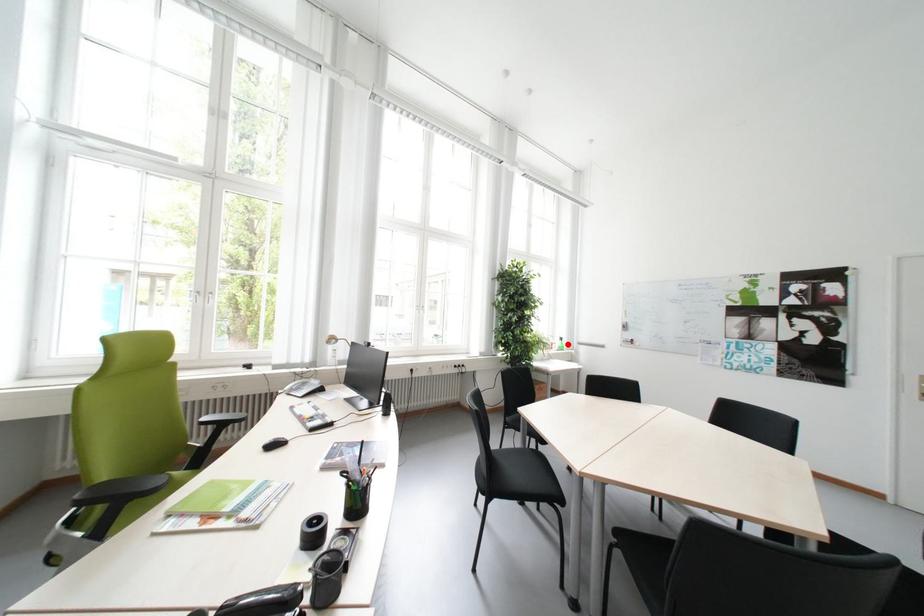
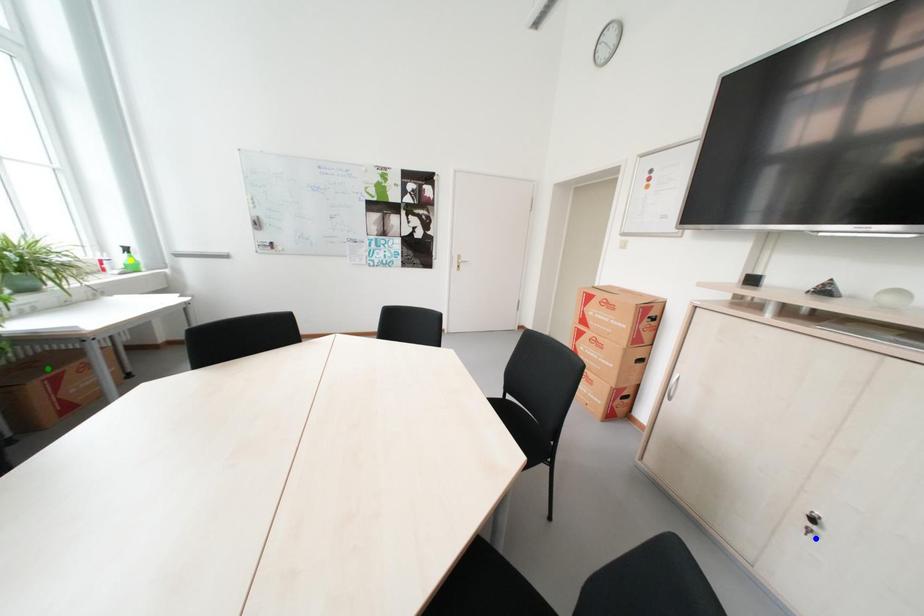
Question: I am providing you with two images of the same scene from different viewpoints. A red point is marked on the first image. You are given multiple points on the second image. Which point in image 2 represents the same 3d spot as the red point in image 1?

Choices:
 (A) green point
 (B) blue point
 (C) yellow point

Answer: (C)